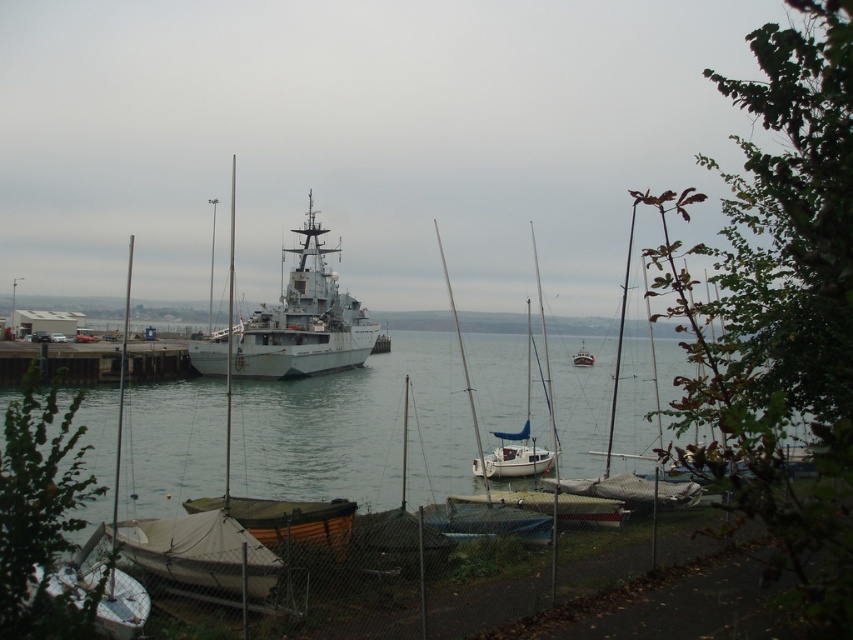
Between green canvas boat at lower center and white matte sailboat at center, which one is positioned lower?

white matte sailboat at center is below.

Is point (339, 499) behind point (577, 360)?

That is False.

At what (x,y) coordinates should I click in order to perform the action: click on green canvas boat at lower center. Please return your answer as a coordinate pair (x, y). The height and width of the screenshot is (640, 853). Looking at the image, I should click on (288, 522).

Does white metallic ship at center lie behind white matte sailboat at center?

No, it is not.

Between white metallic ship at center and white matte sailboat at center, which one has less height?

Standing shorter between the two is white matte sailboat at center.

Who is more forward, (276, 330) or (579, 353)?

Point (276, 330) is more forward.

The width and height of the screenshot is (853, 640). Find the location of `white metallic ship at center`. white metallic ship at center is located at coordinates (294, 324).

Who is shorter, white metallic ship at center or white matte ship at center?

With less height is white metallic ship at center.

Does white metallic ship at center appear under white matte ship at center?

Yes, white metallic ship at center is below white matte ship at center.

Measure the distance between white metallic ship at center and camera.

white metallic ship at center is 28.59 meters from camera.

The height and width of the screenshot is (640, 853). In order to click on white metallic ship at center in this screenshot , I will do `click(294, 324)`.